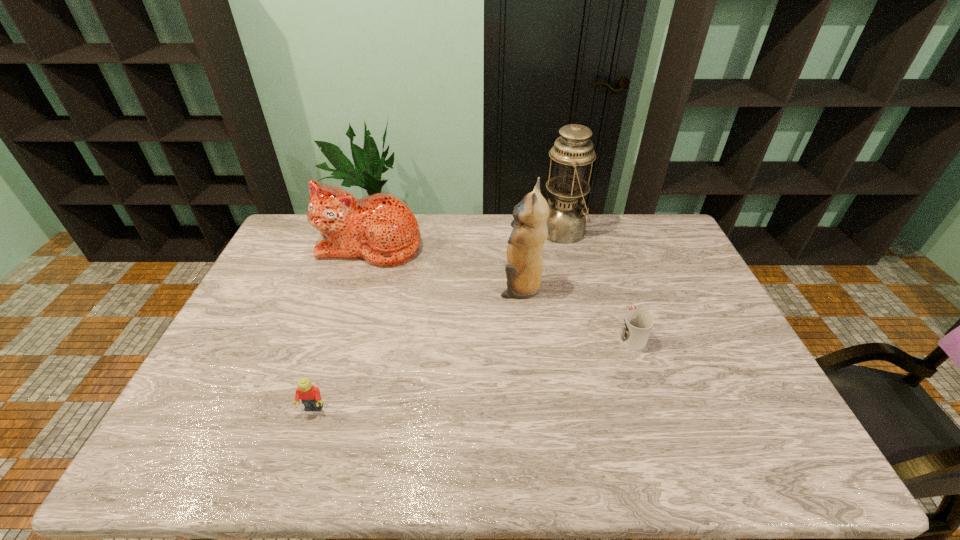
You are a GUI agent. You are given a task and a screenshot of the screen. Output one action in this format:
    pyautogui.click(x=<x>, y=<y>)
    Task: Click on the oil lamp
    
    Given the screenshot: What is the action you would take?
    pyautogui.click(x=572, y=152)

I want to click on the third farthest object, so click(524, 270).

Where is `the right cat`? The image size is (960, 540). the right cat is located at coordinates (524, 270).

Locate an element on the screen. The image size is (960, 540). the left cat is located at coordinates (380, 228).

Find the location of a particular element. The width and height of the screenshot is (960, 540). the farther cat is located at coordinates (380, 228).

In order to click on the fourth tallest object in this screenshot , I will do `click(310, 396)`.

The width and height of the screenshot is (960, 540). In order to click on Lego in this screenshot , I will do `click(310, 396)`.

You are a GUI agent. You are given a task and a screenshot of the screen. Output one action in this format:
    pyautogui.click(x=<x>, y=<y>)
    Task: Click on the cup
    
    Given the screenshot: What is the action you would take?
    pyautogui.click(x=637, y=325)

Identify the location of the shortest object. This screenshot has height=540, width=960. tap(637, 325).

Identify the location of free space located on the left of the oil lamp. (520, 231).